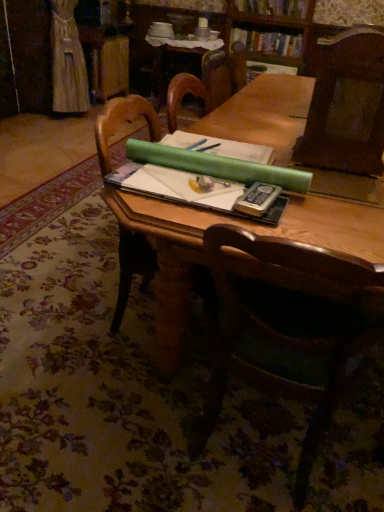
You are a GUI agent. You are given a task and a screenshot of the screen. Output one action in this format:
    pyautogui.click(x=<x>, y=<y>)
    Task: Click on the vacant area situated to the left side of wooden chair at center, arranged as the 2th chair when viewed from the top
    This screenshot has height=512, width=384.
    Given the screenshot: What is the action you would take?
    pyautogui.click(x=128, y=424)